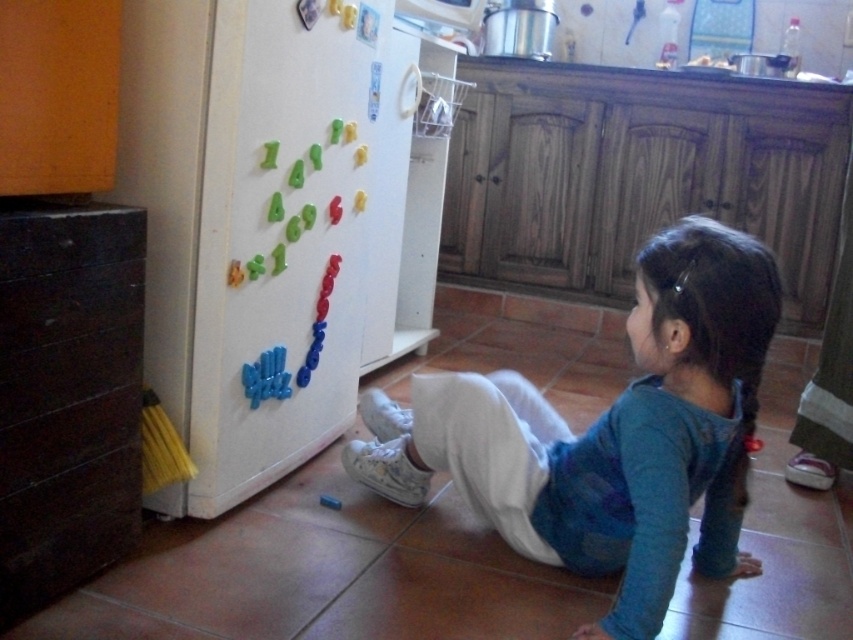
Question: Is blue cotton shirt at lower center positioned behind black wood drawer at left?

Choices:
 (A) yes
 (B) no

Answer: (A)

Question: Which object is the farthest from the blue cotton shirt at lower center?

Choices:
 (A) black wood drawer at left
 (B) white matte refrigerator at left

Answer: (A)

Question: Which of the following is the farthest from the observer?

Choices:
 (A) blue cotton shirt at lower center
 (B) black wood drawer at left

Answer: (A)

Question: Which point appears farthest from the camera in this image?

Choices:
 (A) (259, 211)
 (B) (97, 214)

Answer: (A)

Question: Can you confirm if white matte refrigerator at left is wider than black wood drawer at left?

Choices:
 (A) no
 (B) yes

Answer: (B)

Question: Considering the relative positions of white matte refrigerator at left and blue cotton shirt at lower center in the image provided, where is white matte refrigerator at left located with respect to blue cotton shirt at lower center?

Choices:
 (A) above
 (B) below

Answer: (A)